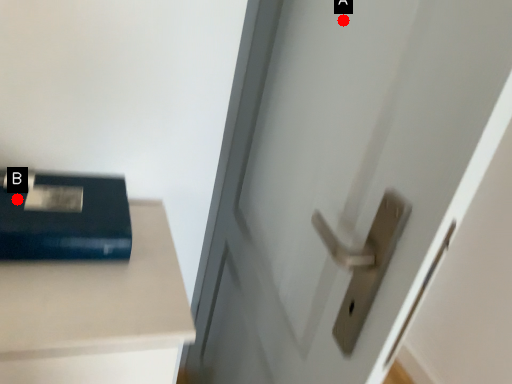
Question: Two points are circled on the image, labeled by A and B beside each circle. Which point is farther from the camera taking this photo?

Choices:
 (A) A is further
 (B) B is further

Answer: (B)